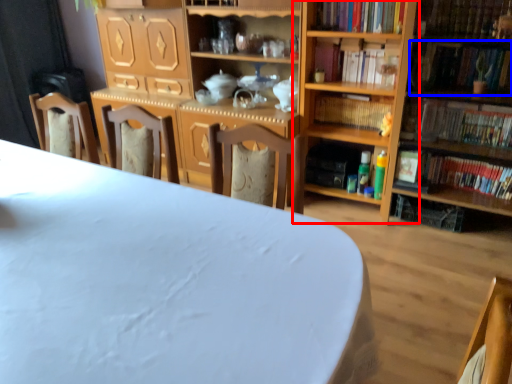
Question: Which of the following is the closest to the observer, shelf (highlighted by a red box) or book (highlighted by a blue box)?

Choices:
 (A) shelf
 (B) book

Answer: (B)